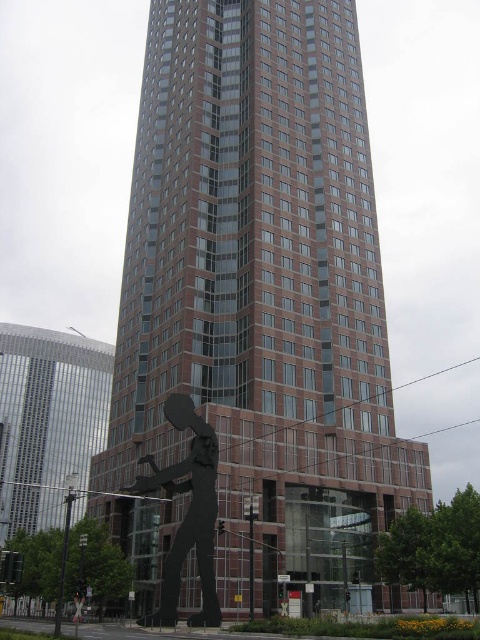
Question: Is brown brick building at center closer to camera compared to black matte sculpture at lower center?

Choices:
 (A) no
 (B) yes

Answer: (A)

Question: Is brown brick building at center further to the viewer compared to black matte sculpture at lower center?

Choices:
 (A) no
 (B) yes

Answer: (B)

Question: Does brown brick building at center have a greater width compared to black matte sculpture at lower center?

Choices:
 (A) yes
 (B) no

Answer: (A)

Question: Which of the following is the farthest from the observer?

Choices:
 (A) black matte sculpture at lower center
 (B) brown brick building at center

Answer: (B)

Question: Which object is closer to the camera taking this photo?

Choices:
 (A) brown brick building at center
 (B) black matte sculpture at lower center

Answer: (B)